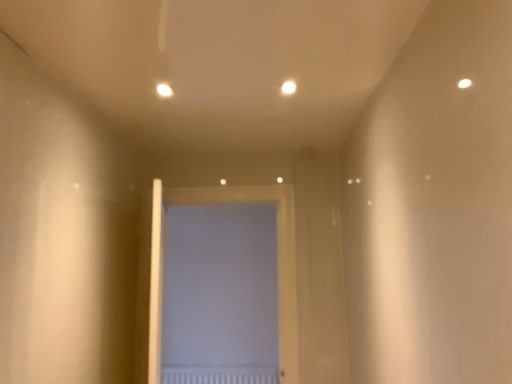
Question: Relative to white textured radiator at center, is white matte door at center in front or behind?

Choices:
 (A) behind
 (B) front

Answer: (B)

Question: Looking at the image, does white matte door at center seem bigger or smaller compared to white textured radiator at center?

Choices:
 (A) big
 (B) small

Answer: (A)

Question: Which object is positioned closest to the white glossy light at upper center, the 1th light when ordered from right to left?

Choices:
 (A) white textured radiator at center
 (B) white matte door at center
 (C) matte white light at upper center, the second light viewed from the right

Answer: (C)

Question: Which of these objects is positioned closest to the white glossy light at upper center, acting as the 2th light starting from the left?

Choices:
 (A) white textured radiator at center
 (B) white matte door at center
 (C) matte white light at upper center, the second light viewed from the right

Answer: (C)